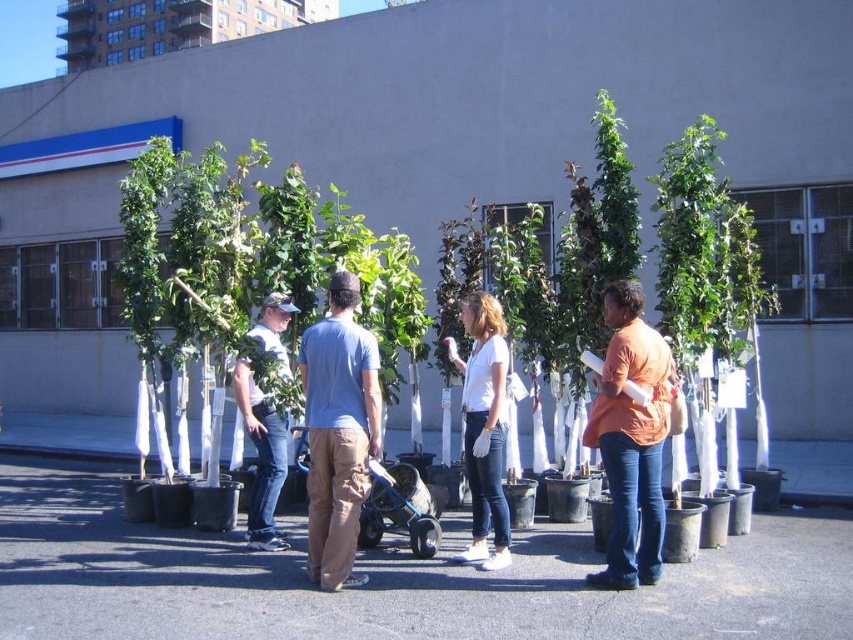
You are standing at point (x=277, y=474) and want to walk to the trees in the background. Is point (x=345, y=403) blocking your path?

Point (x=345, y=403) is in front of point (x=277, y=474), so yes, it is blocking your path to the trees in the background.

You are a photographer standing in the parking lot. You want to take a photo that includes both the blue cotton shirt at center and the orange cotton shirt at center. Which shirt should you focus on first if you want to ensure both are in frame?

The blue cotton shirt at center is taller than the orange cotton shirt at center, so you should focus on the blue cotton shirt at center first to ensure both are in frame.